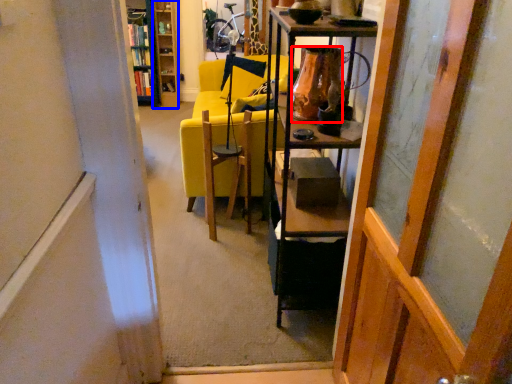
Question: Which point is closer to the camera, vase (highlighted by a red box) or cabinetry (highlighted by a blue box)?

Choices:
 (A) vase
 (B) cabinetry

Answer: (A)